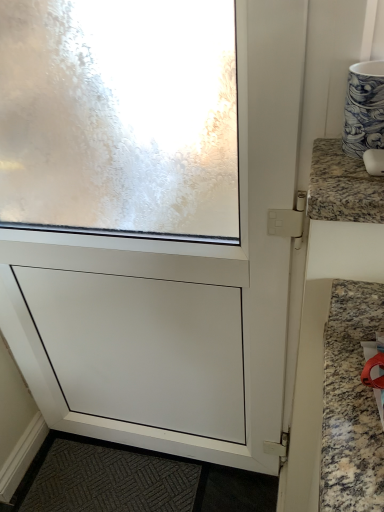
At what (x,y) coordinates should I click in order to perform the action: click on granite mouse at upper right. Please return your answer as a coordinate pair (x, y). This screenshot has height=512, width=384. Looking at the image, I should click on (342, 186).

What is the approximate height of granite mouse at upper right?

It is 2.41 inches.

Measure the distance between point [330,174] and camera.

A distance of 23.15 inches exists between point [330,174] and camera.

This screenshot has width=384, height=512. What do you see at coordinates (342, 186) in the screenshot?
I see `granite mouse at upper right` at bounding box center [342, 186].

Describe the element at coordinates (199, 258) in the screenshot. I see `white matte screen door at center` at that location.

The width and height of the screenshot is (384, 512). Identify the location of white matte screen door at center. (199, 258).

I want to click on granite mouse at upper right, so click(342, 186).

Does granite mouse at upper right appear on the left side of white matte screen door at center?

Incorrect, granite mouse at upper right is not on the left side of white matte screen door at center.

Which object is further away from the camera taking this photo, granite mouse at upper right or white matte screen door at center?

white matte screen door at center is behind.

Which is behind, point (370, 205) or point (234, 461)?

Point (234, 461)

From the image's perspective, who appears lower, granite mouse at upper right or white matte screen door at center?

From the image's view, white matte screen door at center is below.

From a real-world perspective, who is located higher, granite mouse at upper right or white matte screen door at center?

granite mouse at upper right, from a real-world perspective.

Can you confirm if granite mouse at upper right is thinner than white matte screen door at center?

Incorrect, the width of granite mouse at upper right is not less than that of white matte screen door at center.

Is granite mouse at upper right taller or shorter than white matte screen door at center?

Considering their sizes, granite mouse at upper right has less height than white matte screen door at center.

Considering the relative sizes of granite mouse at upper right and white matte screen door at center in the image provided, is granite mouse at upper right smaller than white matte screen door at center?

Correct, granite mouse at upper right occupies less space than white matte screen door at center.

Would you say white matte screen door at center is part of granite mouse at upper right's contents?

No, white matte screen door at center is not surrounded by granite mouse at upper right.

Looking at this image, would you say granite mouse at upper right is a long distance from white matte screen door at center?

No, granite mouse at upper right is in close proximity to white matte screen door at center.

Could you tell me if granite mouse at upper right is facing white matte screen door at center?

No, granite mouse at upper right is not facing towards white matte screen door at center.

How different are the orientations of granite mouse at upper right and white matte screen door at center in degrees?

The angle between the facing direction of granite mouse at upper right and the facing direction of white matte screen door at center is 0.00208 degrees.

Measure the distance from granite mouse at upper right to white matte screen door at center.

granite mouse at upper right and white matte screen door at center are 22.97 inches apart.

I want to click on countertop that appears above the white matte screen door at center (from a real-world perspective), so click(342, 186).

Consider the image. Is white matte screen door at center at the left side of granite mouse at upper right?

Correct, you'll find white matte screen door at center to the left of granite mouse at upper right.

Is white matte screen door at center closer to the viewer compared to granite mouse at upper right?

No, it is not.

Between point (283, 10) and point (322, 161), which one is positioned in front?

The point (283, 10) is in front.

From the image's perspective, is white matte screen door at center under granite mouse at upper right?

Yes, from the image's perspective, white matte screen door at center is below granite mouse at upper right.

From a real-world perspective, is white matte screen door at center positioned above or below granite mouse at upper right?

In terms of real-world spatial position, white matte screen door at center is below granite mouse at upper right.

Which object is thinner, white matte screen door at center or granite mouse at upper right?

Thinner between the two is white matte screen door at center.

Considering the sizes of objects white matte screen door at center and granite mouse at upper right in the image provided, who is taller, white matte screen door at center or granite mouse at upper right?

white matte screen door at center is taller.

Which of these two, white matte screen door at center or granite mouse at upper right, is bigger?

With larger size is white matte screen door at center.

Is white matte screen door at center positioned beyond the bounds of granite mouse at upper right?

Yes.

Is white matte screen door at center next to granite mouse at upper right and touching it?

white matte screen door at center is not next to granite mouse at upper right, and they're not touching.

Is white matte screen door at center turned away from granite mouse at upper right?

No.

Where is `countertop above the white matte screen door at center (from a real-world perspective)`? The width and height of the screenshot is (384, 512). countertop above the white matte screen door at center (from a real-world perspective) is located at coordinates (342, 186).

The width and height of the screenshot is (384, 512). Find the location of `screen door below the granite mouse at upper right (from a real-world perspective)`. screen door below the granite mouse at upper right (from a real-world perspective) is located at coordinates (199, 258).

Locate an element on the screen. countertop above the white matte screen door at center (from the image's perspective) is located at coordinates (342, 186).